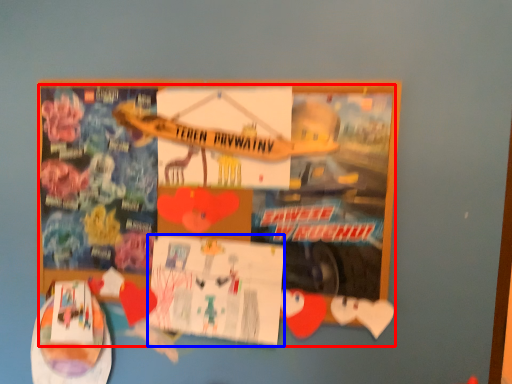
Question: Which of the following is the farthest to the observer, poster (highlighted by a red box) or flyer (highlighted by a blue box)?

Choices:
 (A) poster
 (B) flyer

Answer: (B)